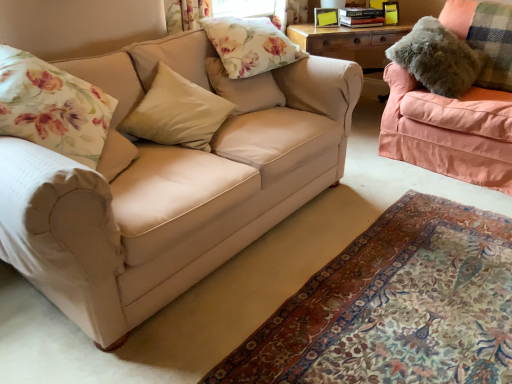
Question: Is beige fabric pillow at center, which is counted as the 2th pillow, starting from the left, smaller than pink fabric couch at right, the first studio couch when ordered from right to left?

Choices:
 (A) yes
 (B) no

Answer: (A)

Question: Does beige fabric pillow at center, which is counted as the 2th pillow, starting from the left, come behind pink fabric couch at right, the first studio couch when ordered from right to left?

Choices:
 (A) no
 (B) yes

Answer: (A)

Question: From a real-world perspective, is beige fabric pillow at center, the third pillow in the right-to-left sequence, physically below pink fabric couch at right, the first studio couch when ordered from right to left?

Choices:
 (A) no
 (B) yes

Answer: (A)

Question: Is beige fabric pillow at center, the third pillow in the right-to-left sequence, not close to pink fabric couch at right, the first studio couch when ordered from right to left?

Choices:
 (A) no
 (B) yes

Answer: (B)

Question: Considering the relative positions of beige fabric pillow at center, which is counted as the 2th pillow, starting from the left, and pink fabric couch at right, which is counted as the 2th studio couch, starting from the left, in the image provided, is beige fabric pillow at center, which is counted as the 2th pillow, starting from the left, to the left of pink fabric couch at right, which is counted as the 2th studio couch, starting from the left, from the viewer's perspective?

Choices:
 (A) no
 (B) yes

Answer: (B)

Question: Is beige fabric pillow at center, the third pillow in the right-to-left sequence, placed right next to pink fabric couch at right, the first studio couch when ordered from right to left?

Choices:
 (A) no
 (B) yes

Answer: (A)

Question: From a real-world perspective, does beige fabric pillow at center, which is counted as the 2th pillow, starting from the left, stand above floral fabric pillow at upper center, which ranks as the third pillow in left-to-right order?

Choices:
 (A) yes
 (B) no

Answer: (B)

Question: From a real-world perspective, is beige fabric pillow at center, which is counted as the 2th pillow, starting from the left, under floral fabric pillow at upper center, marked as the second pillow in a right-to-left arrangement?

Choices:
 (A) no
 (B) yes

Answer: (B)

Question: Can you confirm if beige fabric pillow at center, the third pillow in the right-to-left sequence, is wider than floral fabric pillow at upper center, which ranks as the third pillow in left-to-right order?

Choices:
 (A) yes
 (B) no

Answer: (A)

Question: Can you confirm if beige fabric pillow at center, the third pillow in the right-to-left sequence, is smaller than floral fabric pillow at upper center, marked as the second pillow in a right-to-left arrangement?

Choices:
 (A) yes
 (B) no

Answer: (B)

Question: Is beige fabric pillow at center, which is counted as the 2th pillow, starting from the left, aimed at floral fabric pillow at upper center, marked as the second pillow in a right-to-left arrangement?

Choices:
 (A) yes
 (B) no

Answer: (B)

Question: Is the depth of beige fabric pillow at center, the third pillow in the right-to-left sequence, greater than that of floral fabric pillow at upper center, marked as the second pillow in a right-to-left arrangement?

Choices:
 (A) no
 (B) yes

Answer: (A)

Question: Considering the relative sizes of beige fabric couch at left, which appears as the 2th studio couch when viewed from the right, and floral fabric pillow at upper center in the image provided, is beige fabric couch at left, which appears as the 2th studio couch when viewed from the right, taller than floral fabric pillow at upper center?

Choices:
 (A) yes
 (B) no

Answer: (A)